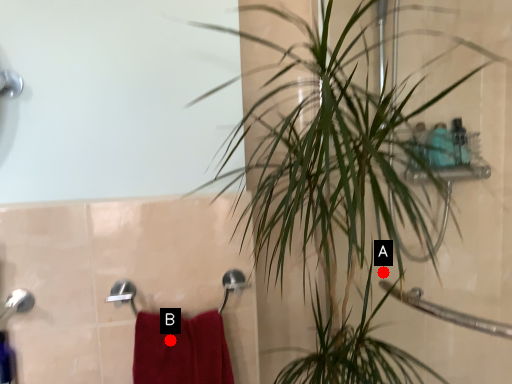
Question: Two points are circled on the image, labeled by A and B beside each circle. Among these points, which one is farthest from the camera?

Choices:
 (A) A is further
 (B) B is further

Answer: (A)